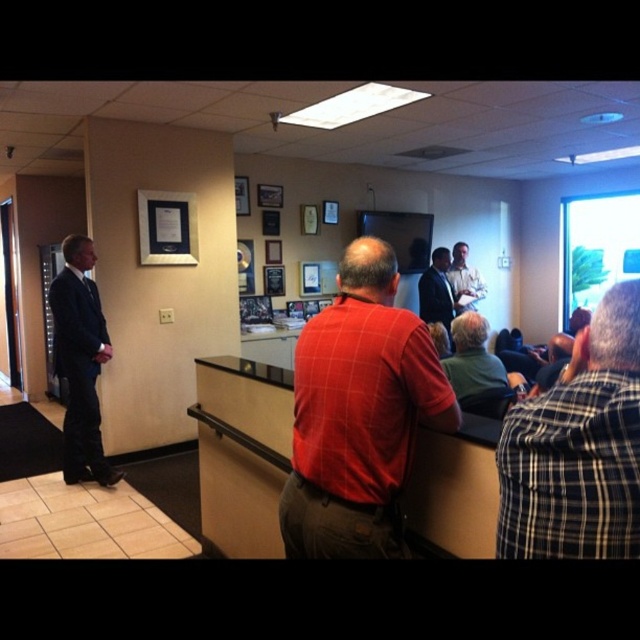
Is point (552, 452) more distant than point (452, 282)?

No, (552, 452) is in front of (452, 282).

Is blue plaid shirt at right below matte black shirt at center?

Yes.

Who is more forward, (506,486) or (460,276)?

Point (506,486) is more forward.

At what (x,y) coordinates should I click in order to perform the action: click on blue plaid shirt at right. Please return your answer as a coordinate pair (x, y). The height and width of the screenshot is (640, 640). Looking at the image, I should click on (577, 448).

Is point (481, 326) more distant than point (452, 248)?

No, it is not.

I want to click on green fabric shirt at center, so (x=472, y=356).

Who is positioned more to the left, red plaid shirt at center or blue plaid shirt at right?

red plaid shirt at center is more to the left.

Does red plaid shirt at center have a lesser width compared to blue plaid shirt at right?

No, red plaid shirt at center is not thinner than blue plaid shirt at right.

Between point (340, 470) and point (596, 348), which one is positioned in front?

Point (596, 348) is in front.

You are a GUI agent. You are given a task and a screenshot of the screen. Output one action in this format:
    pyautogui.click(x=<x>, y=<y>)
    Task: Click on the red plaid shirt at center
    
    Given the screenshot: What is the action you would take?
    pyautogui.click(x=358, y=413)